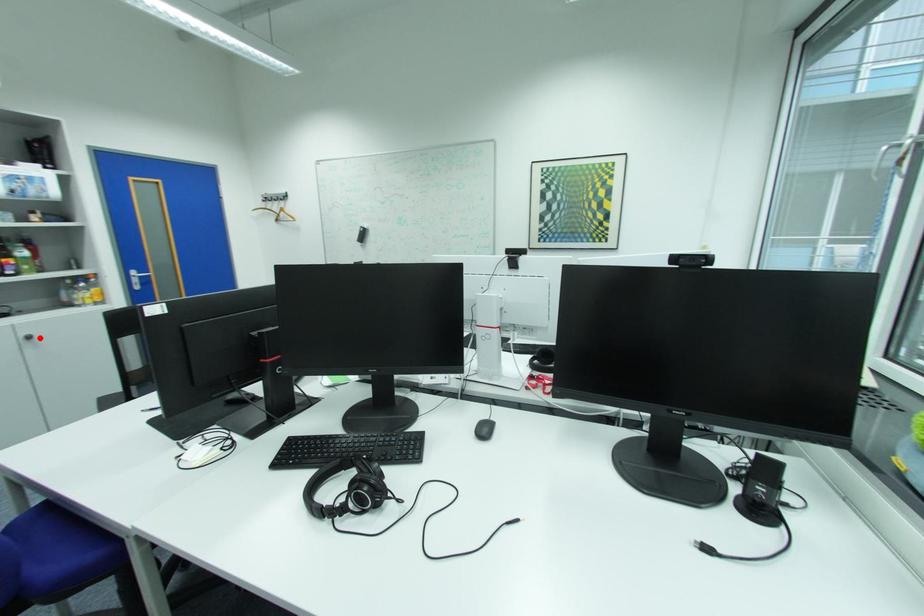
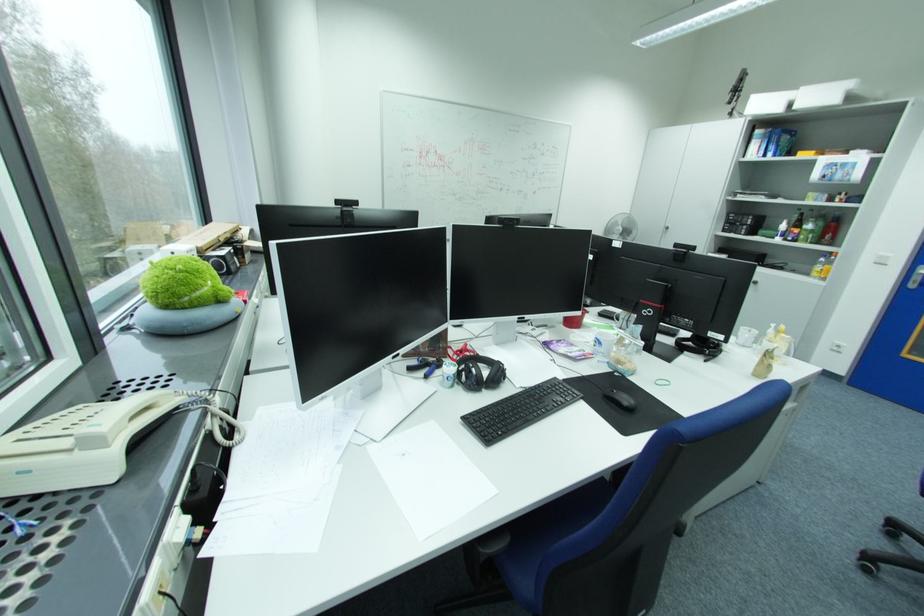
Question: I am providing you with two images of the same scene from different viewpoints. Image1 has a red point marked. In image2, the corresponding 3D location appears at what relative position? Reply with the corresponding letter.

Choices:
 (A) Closer
 (B) Farther

Answer: (A)